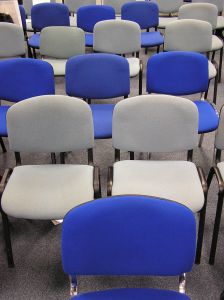
This screenshot has width=224, height=300. I want to click on steel frame for chair, so click(73, 289), click(182, 287).